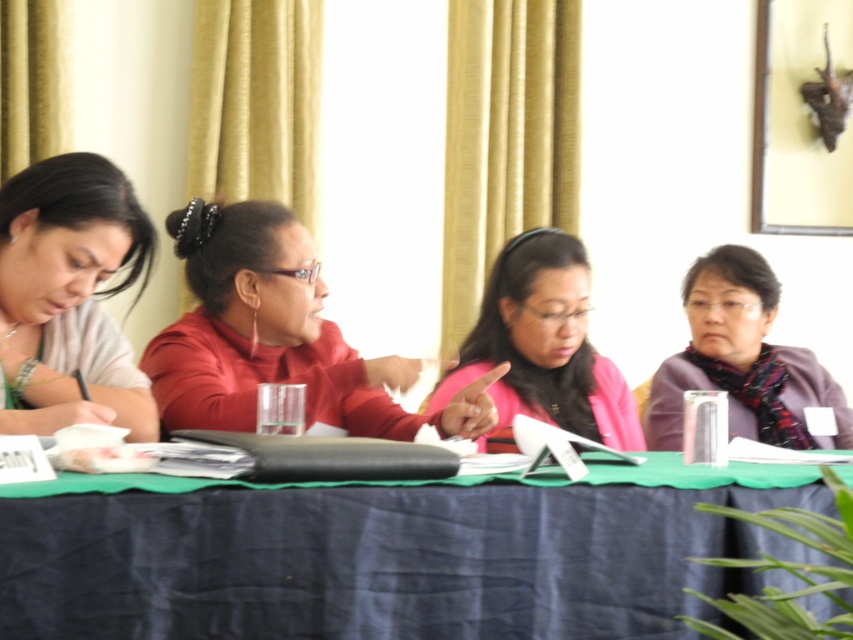
Question: Does matte white shirt at left have a lesser width compared to pink matte jacket at center?

Choices:
 (A) no
 (B) yes

Answer: (B)

Question: Estimate the real-world distances between objects in this image. Which object is farther from the pink matte jacket at center?

Choices:
 (A) purple scarf at right
 (B) matte white shirt at left
 (C) blue fabric tablecloth at center

Answer: (B)

Question: Which of these objects is positioned closest to the blue fabric tablecloth at center?

Choices:
 (A) purple scarf at right
 (B) matte white shirt at left
 (C) matte red shirt at center

Answer: (B)

Question: Does matte red shirt at center have a lesser width compared to matte white shirt at left?

Choices:
 (A) yes
 (B) no

Answer: (B)

Question: Is blue fabric tablecloth at center above pink matte jacket at center?

Choices:
 (A) no
 (B) yes

Answer: (A)

Question: Among these objects, which one is farthest from the camera?

Choices:
 (A) matte white shirt at left
 (B) blue fabric tablecloth at center
 (C) matte red shirt at center
 (D) purple scarf at right

Answer: (D)